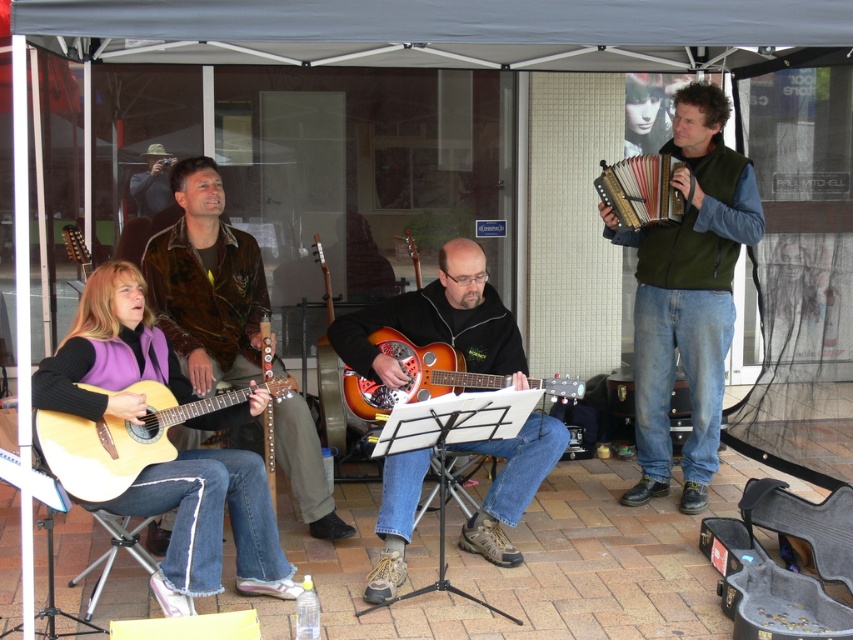
Question: Can you confirm if matte purple vest at lower left is wider than brushed leather jacket at upper left?

Choices:
 (A) no
 (B) yes

Answer: (A)

Question: Which of the following is the closest to the observer?

Choices:
 (A) (654, 202)
 (B) (144, 214)
 (C) (90, 262)
 (D) (65, 403)

Answer: (D)

Question: Is brushed leather jacket at upper left closer to the viewer compared to light brown acoustic guitar at lower left?

Choices:
 (A) yes
 (B) no

Answer: (B)

Question: Can you confirm if brushed leather jacket at upper left is positioned above light brown acoustic guitar at lower left?

Choices:
 (A) yes
 (B) no

Answer: (A)

Question: Which object appears farthest from the camera in this image?

Choices:
 (A) sunburst wood resonator guitar at center
 (B) green textured vest at upper right

Answer: (B)

Question: Which is nearer to the matte brown acoustic guitar at left?

Choices:
 (A) green textured vest at upper right
 (B) matte purple vest at lower left
 (C) sunburst wood resonator guitar at center

Answer: (B)